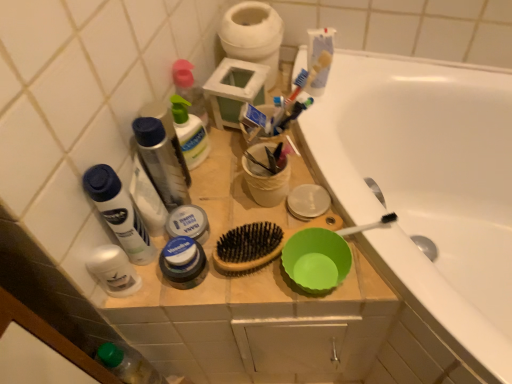
Question: Is white matte toilet paper at upper center at the left side of translucent plastic mouthwash at upper left?

Choices:
 (A) yes
 (B) no

Answer: (B)

Question: Considering the relative sizes of white matte toilet paper at upper center and translucent plastic mouthwash at upper left in the image provided, is white matte toilet paper at upper center thinner than translucent plastic mouthwash at upper left?

Choices:
 (A) yes
 (B) no

Answer: (B)

Question: Can you confirm if white matte toilet paper at upper center is shorter than translucent plastic mouthwash at upper left?

Choices:
 (A) no
 (B) yes

Answer: (B)

Question: Does white matte toilet paper at upper center turn towards translucent plastic mouthwash at upper left?

Choices:
 (A) no
 (B) yes

Answer: (A)

Question: Are white matte toilet paper at upper center and translucent plastic mouthwash at upper left located far from each other?

Choices:
 (A) no
 (B) yes

Answer: (A)

Question: In the image, is white matte jar at center, which is the 3th toiletry in top-to-bottom order, on the left side or the right side of metallic silver bowl at upper right, marked as the second basin in a bottom-to-top arrangement?

Choices:
 (A) right
 (B) left

Answer: (B)

Question: In terms of width, does white matte jar at center, which is counted as the 3th toiletry, starting from the bottom, look wider or thinner when compared to metallic silver bowl at upper right, the second basin positioned from the top?

Choices:
 (A) wide
 (B) thin

Answer: (A)

Question: From a real-world perspective, is white matte jar at center, which is counted as the 3th toiletry, starting from the bottom, positioned above or below metallic silver bowl at upper right, the second basin positioned from the top?

Choices:
 (A) below
 (B) above

Answer: (B)

Question: Based on their sizes in the image, would you say white matte jar at center, which is the 3th toiletry in top-to-bottom order, is bigger or smaller than metallic silver bowl at upper right, marked as the second basin in a bottom-to-top arrangement?

Choices:
 (A) big
 (B) small

Answer: (A)

Question: Visually, is translucent plastic mouthwash at upper left positioned to the left or to the right of metallic silver bowl at upper right, the second basin positioned from the top?

Choices:
 (A) right
 (B) left

Answer: (B)

Question: From the image's perspective, is translucent plastic mouthwash at upper left above or below metallic silver bowl at upper right, the second basin positioned from the top?

Choices:
 (A) above
 (B) below

Answer: (A)

Question: From their relative heights in the image, would you say translucent plastic mouthwash at upper left is taller or shorter than metallic silver bowl at upper right, marked as the second basin in a bottom-to-top arrangement?

Choices:
 (A) tall
 (B) short

Answer: (A)

Question: Choose the correct answer: Is translucent plastic mouthwash at upper left inside metallic silver bowl at upper right, the second basin positioned from the top, or outside it?

Choices:
 (A) outside
 (B) inside

Answer: (A)

Question: From the image's perspective, is green plastic bowl at center, which is the 1th basin in bottom-to-top order, located above or below white matte jar at center, which is counted as the 3th toiletry, starting from the bottom?

Choices:
 (A) above
 (B) below

Answer: (B)

Question: From a real-world perspective, is green plastic bowl at center, positioned as the third basin in top-to-bottom order, above or below white matte jar at center, which is counted as the 3th toiletry, starting from the bottom?

Choices:
 (A) below
 (B) above

Answer: (A)